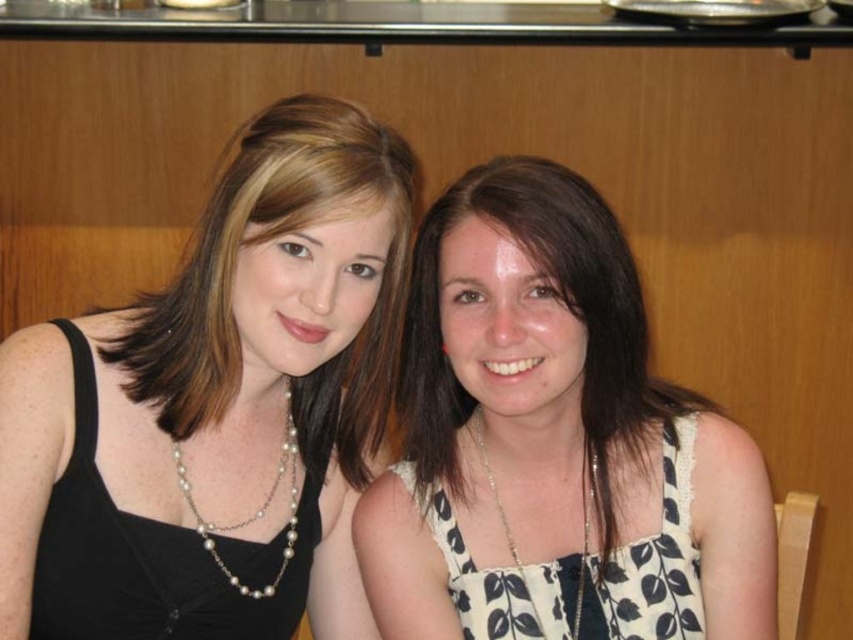
Question: Is pearl necklace at left wider than white printed fabric dress at center?

Choices:
 (A) yes
 (B) no

Answer: (A)

Question: Can you confirm if white dotted dress at center is positioned below white printed fabric dress at center?

Choices:
 (A) no
 (B) yes

Answer: (A)

Question: Among these points, which one is nearest to the camera?

Choices:
 (A) (273, 196)
 (B) (543, 429)

Answer: (A)

Question: Is pearl necklace at left below white printed fabric dress at center?

Choices:
 (A) no
 (B) yes

Answer: (A)

Question: Estimate the real-world distances between objects in this image. Which object is farther from the black satin dress at left?

Choices:
 (A) white dotted dress at center
 (B) white printed fabric dress at center
 (C) pearl necklace at left

Answer: (B)

Question: Among these objects, which one is farthest from the camera?

Choices:
 (A) white dotted dress at center
 (B) pearl necklace at left
 (C) white printed fabric dress at center
 (D) black satin dress at left

Answer: (C)